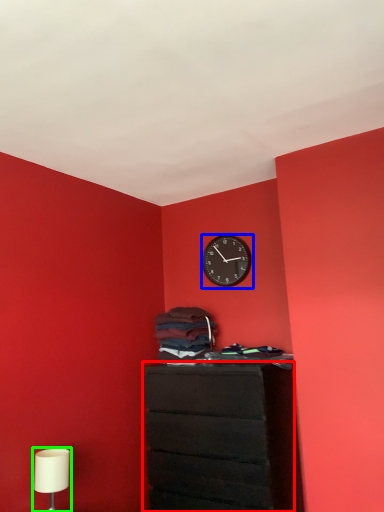
Question: Which object is the closest to the chest of drawers (highlighted by a red box)? Choose among these: wall clock (highlighted by a blue box) or table lamp (highlighted by a green box).

Choices:
 (A) wall clock
 (B) table lamp

Answer: (B)